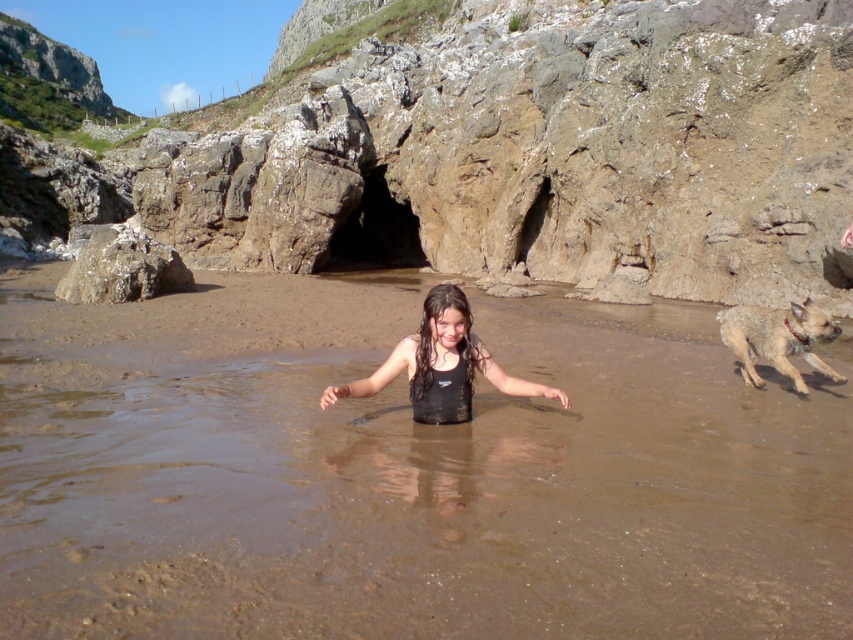
In the scene shown: You are a photographer trying to capture the entire scene of the brown wet sand at center and the black matte swimsuit at center in one shot. Based on their widths, which object should you ensure is fully visible first to avoid cropping?

The brown wet sand at center has a greater width than the black matte swimsuit at center, so you should ensure the brown wet sand at center is fully visible first to avoid cropping.

Consider the image. You are standing on the rocky beach and want to place a small flag on the smooth gray rock at center so that it can be seen from the brown furry dog at right. Is the flag visible from the dog?

The smooth gray rock at center is located above the brown furry dog at right, so the flag placed on the smooth gray rock at center would be visible from the dog.